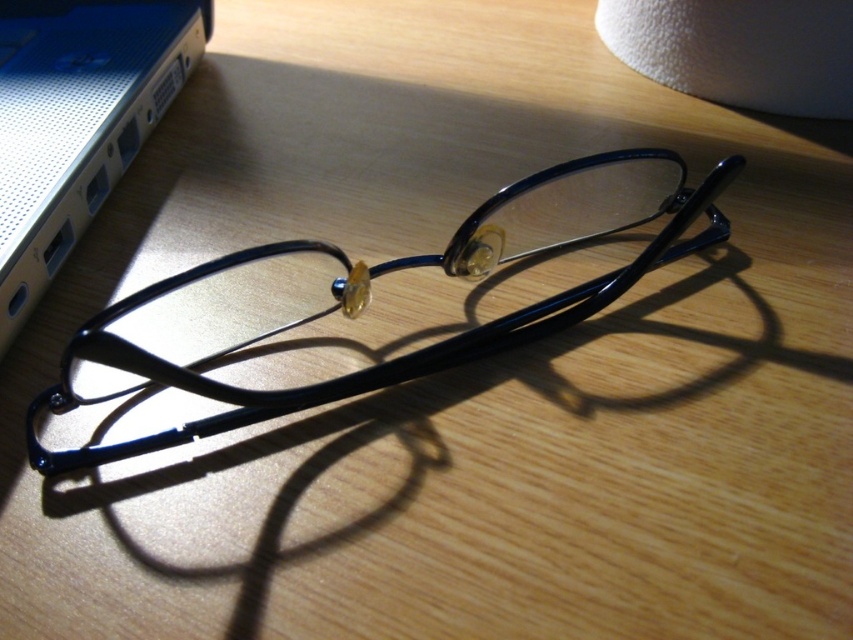
Is glossy plastic glasses at center positioned behind satin silver laptop at upper left?

No, it is not.

Which is more to the right, glossy plastic glasses at center or satin silver laptop at upper left?

glossy plastic glasses at center is more to the right.

Between point (688, 218) and point (149, 92), which one is positioned behind?

The point (149, 92) is more distant.

At what (x,y) coordinates should I click in order to perform the action: click on glossy plastic glasses at center. Please return your answer as a coordinate pair (x, y). Looking at the image, I should click on (363, 300).